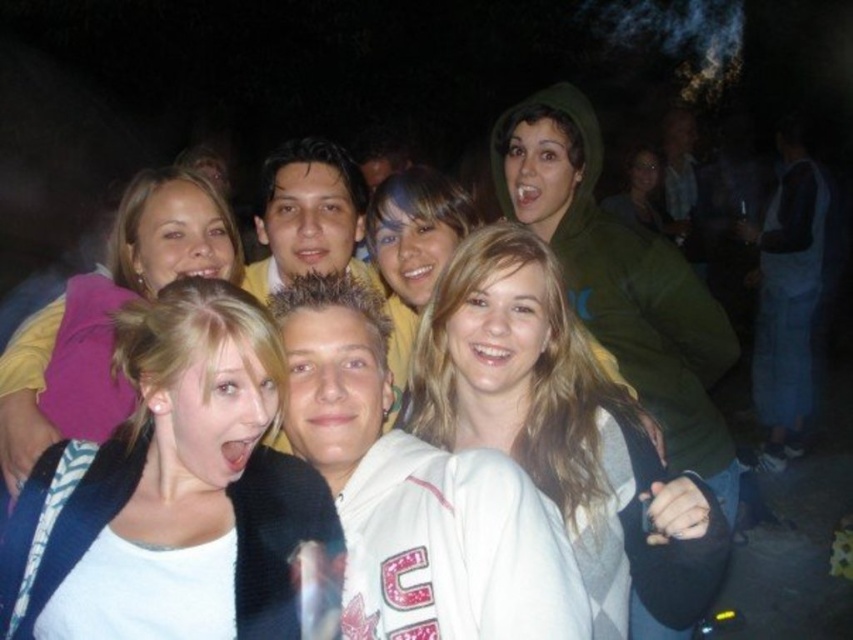
Question: Can you confirm if pink fleece vest at upper left is positioned to the left of matte green hoodie at upper center?

Choices:
 (A) no
 (B) yes

Answer: (B)

Question: Which object appears closest to the camera in this image?

Choices:
 (A) pink fleece vest at upper left
 (B) matte green hoodie at upper center
 (C) white fleece jacket at center
 (D) white matte jacket at center

Answer: (C)

Question: Can you confirm if white matte jacket at center is positioned below matte green hoodie at upper center?

Choices:
 (A) no
 (B) yes

Answer: (B)

Question: Which point is farther from the camera taking this photo?

Choices:
 (A) (640, 196)
 (B) (439, 307)
 (C) (370, 621)

Answer: (A)

Question: Does white sweater at center have a greater width compared to matte green hoodie at upper center?

Choices:
 (A) no
 (B) yes

Answer: (A)

Question: Among these objects, which one is nearest to the camera?

Choices:
 (A) white fleece jacket at center
 (B) smooth green hoodie at upper center
 (C) matte green hoodie at upper center

Answer: (A)